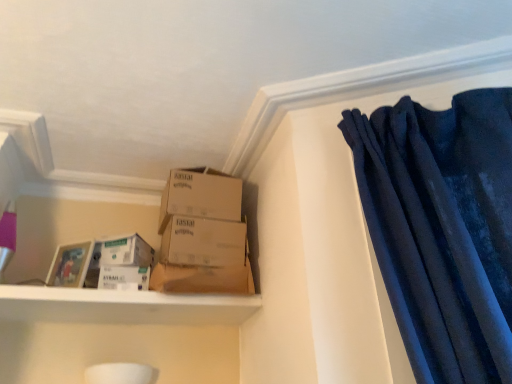
Question: Should I look upward or downward to see velvet dark blue curtain at upper right?

Choices:
 (A) down
 (B) up

Answer: (B)

Question: Can you confirm if brown cardboard box at center is bigger than white matte shelf at lower left?

Choices:
 (A) yes
 (B) no

Answer: (B)

Question: Considering the relative positions of brown cardboard box at center and white matte shelf at lower left in the image provided, is brown cardboard box at center to the right of white matte shelf at lower left from the viewer's perspective?

Choices:
 (A) yes
 (B) no

Answer: (A)

Question: From a real-world perspective, is brown cardboard box at center under white matte shelf at lower left?

Choices:
 (A) no
 (B) yes

Answer: (A)

Question: Is brown cardboard box at center with white matte shelf at lower left?

Choices:
 (A) no
 (B) yes

Answer: (A)

Question: Is brown cardboard box at center outside white matte shelf at lower left?

Choices:
 (A) yes
 (B) no

Answer: (A)

Question: Is brown cardboard box at center taller than white matte shelf at lower left?

Choices:
 (A) yes
 (B) no

Answer: (A)

Question: Is velvet dark blue curtain at upper right not near white matte shelf at lower left?

Choices:
 (A) yes
 (B) no

Answer: (B)

Question: Is velvet dark blue curtain at upper right taller than white matte shelf at lower left?

Choices:
 (A) no
 (B) yes

Answer: (B)

Question: Considering the relative sizes of velvet dark blue curtain at upper right and white matte shelf at lower left in the image provided, is velvet dark blue curtain at upper right shorter than white matte shelf at lower left?

Choices:
 (A) no
 (B) yes

Answer: (A)

Question: Does velvet dark blue curtain at upper right come in front of white matte shelf at lower left?

Choices:
 (A) yes
 (B) no

Answer: (A)

Question: Considering the relative sizes of velvet dark blue curtain at upper right and white matte shelf at lower left in the image provided, is velvet dark blue curtain at upper right thinner than white matte shelf at lower left?

Choices:
 (A) no
 (B) yes

Answer: (A)

Question: Can you confirm if velvet dark blue curtain at upper right is bigger than white matte shelf at lower left?

Choices:
 (A) yes
 (B) no

Answer: (A)

Question: Is white cardboard box at lower left, which is the 1th storage box in top-to-bottom order, at the back of brown cardboard box at center, which ranks as the first box in bottom-to-top order?

Choices:
 (A) yes
 (B) no

Answer: (B)